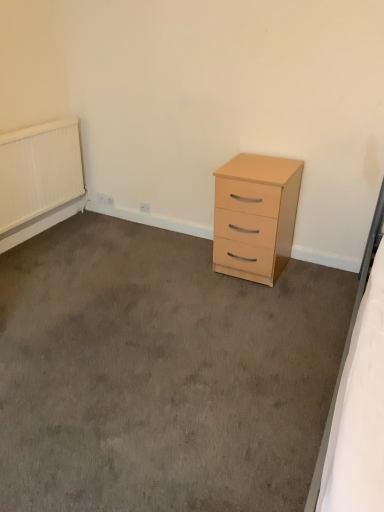
Question: From a real-world perspective, is white textured radiator at upper left located beneath light wood/finish chest of drawers at center-right?

Choices:
 (A) no
 (B) yes

Answer: (A)

Question: Is the position of white textured radiator at upper left less distant than that of light wood/finish chest of drawers at center-right?

Choices:
 (A) no
 (B) yes

Answer: (A)

Question: Is white textured radiator at upper left far from light wood/finish chest of drawers at center-right?

Choices:
 (A) no
 (B) yes

Answer: (B)

Question: Does white textured radiator at upper left have a greater width compared to light wood/finish chest of drawers at center-right?

Choices:
 (A) no
 (B) yes

Answer: (A)

Question: From a real-world perspective, is white textured radiator at upper left physically above light wood/finish chest of drawers at center-right?

Choices:
 (A) no
 (B) yes

Answer: (B)

Question: From the image's perspective, is white textured radiator at upper left below light wood/finish chest of drawers at center-right?

Choices:
 (A) yes
 (B) no

Answer: (B)

Question: Considering the relative positions of light wood/finish chest of drawers at center-right and white textured radiator at upper left in the image provided, is light wood/finish chest of drawers at center-right to the left of white textured radiator at upper left from the viewer's perspective?

Choices:
 (A) yes
 (B) no

Answer: (B)

Question: From a real-world perspective, is light wood/finish chest of drawers at center-right on top of white textured radiator at upper left?

Choices:
 (A) no
 (B) yes

Answer: (A)

Question: Can you confirm if light wood/finish chest of drawers at center-right is shorter than white textured radiator at upper left?

Choices:
 (A) no
 (B) yes

Answer: (A)

Question: Can we say light wood/finish chest of drawers at center-right lies outside white textured radiator at upper left?

Choices:
 (A) no
 (B) yes

Answer: (B)

Question: Considering the relative sizes of light wood/finish chest of drawers at center-right and white textured radiator at upper left in the image provided, is light wood/finish chest of drawers at center-right taller than white textured radiator at upper left?

Choices:
 (A) no
 (B) yes

Answer: (B)

Question: From a real-world perspective, is light wood/finish chest of drawers at center-right physically below white textured radiator at upper left?

Choices:
 (A) yes
 (B) no

Answer: (A)

Question: From a real-world perspective, relative to white textured radiator at upper left, is light wood/finish chest of drawers at center-right vertically above or below?

Choices:
 (A) above
 (B) below

Answer: (B)